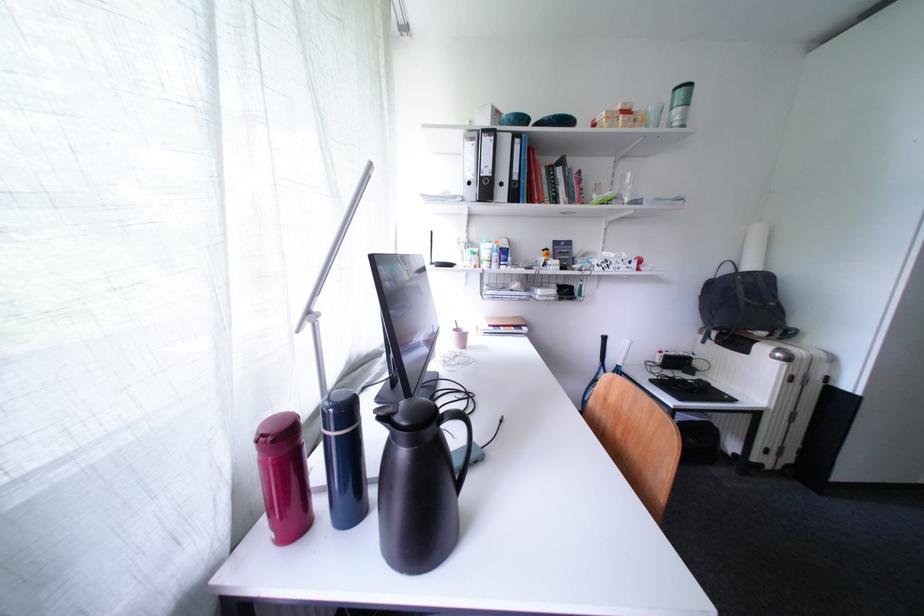
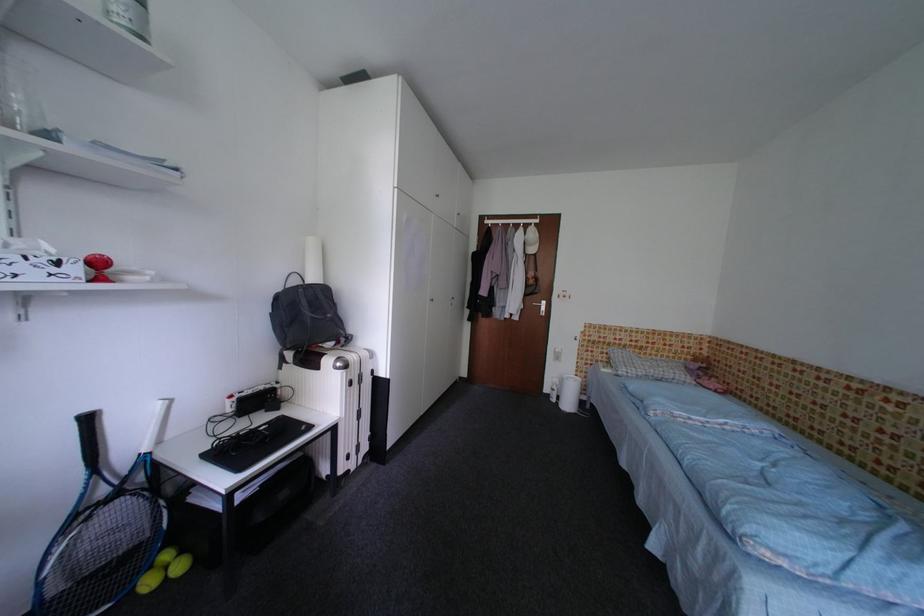
Locate, in the second image, the point that corresponds to (x=688, y=379) in the first image.

(270, 421)